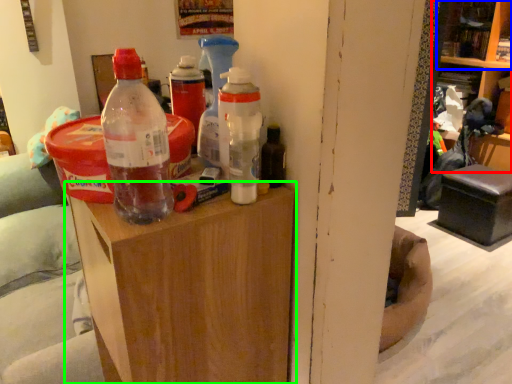
Question: Which object is the farthest from shelf (highlighted by a red box)? Choose among these: shelf (highlighted by a blue box) or furniture (highlighted by a green box).

Choices:
 (A) shelf
 (B) furniture

Answer: (B)